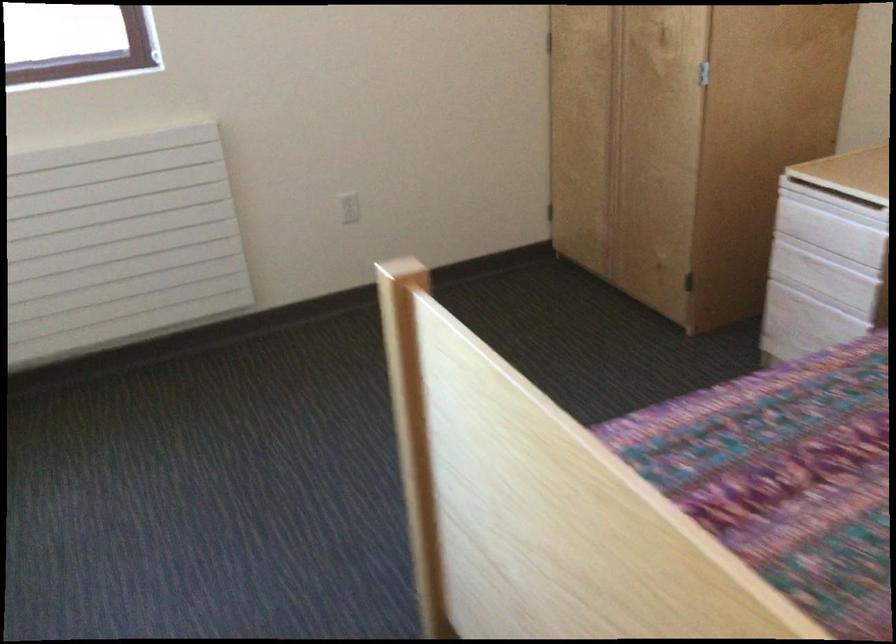
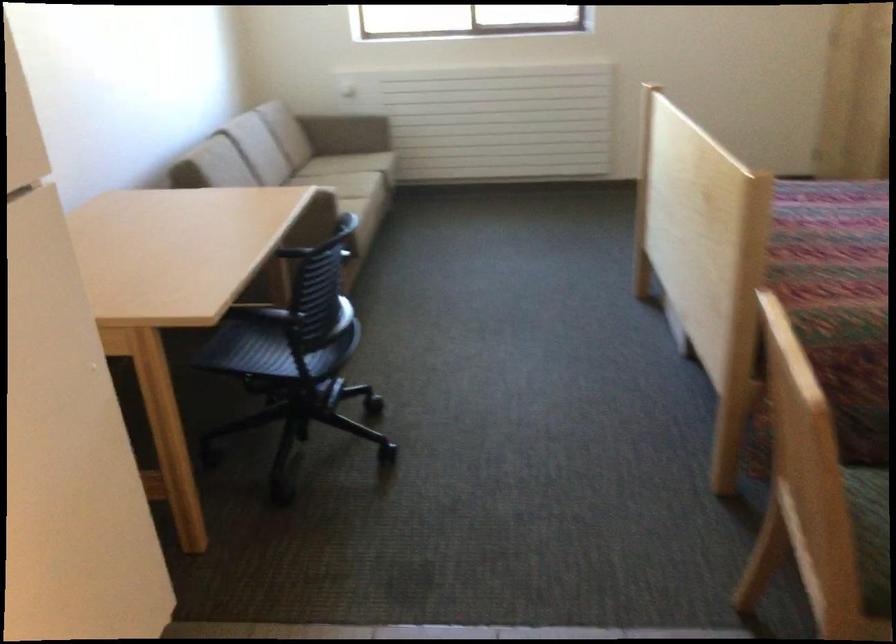
What movement of the cameraman would produce the second image?

The movement direction of the cameraman is right, backward.